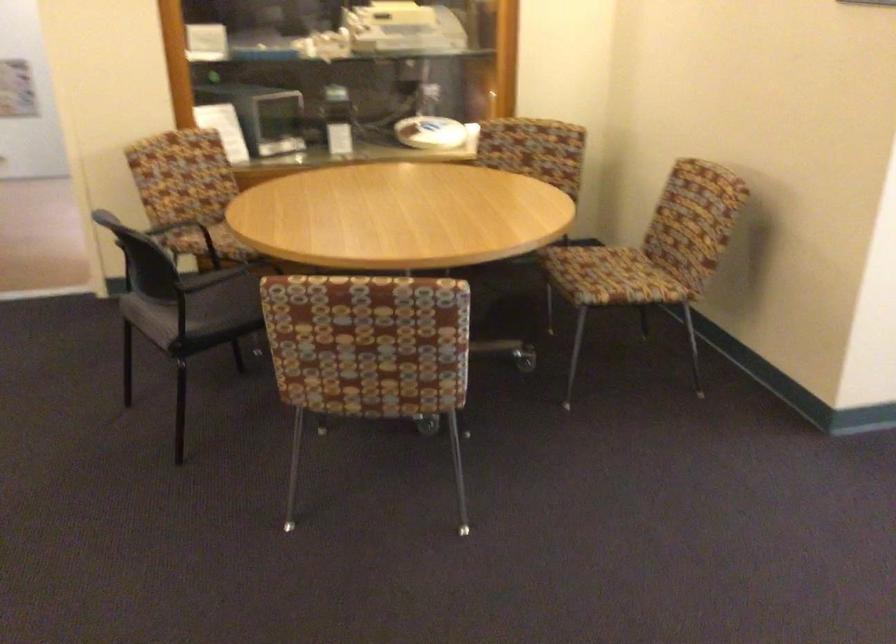
Find where to rest the black chair armrest. Please return your answer as a coordinate pair (x, y).

(167, 220)